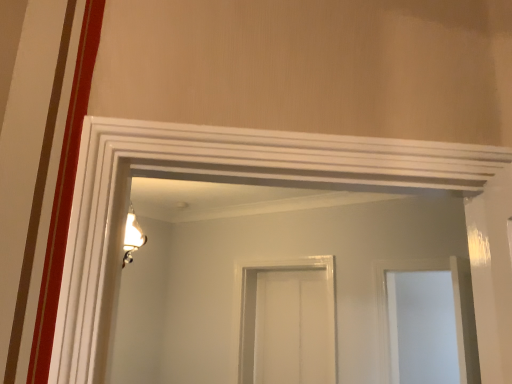
The height and width of the screenshot is (384, 512). In order to click on transparent glass window at center in this screenshot , I will do `click(454, 305)`.

The width and height of the screenshot is (512, 384). What do you see at coordinates (454, 305) in the screenshot?
I see `transparent glass window at center` at bounding box center [454, 305].

Identify the location of transparent glass window at center. (454, 305).